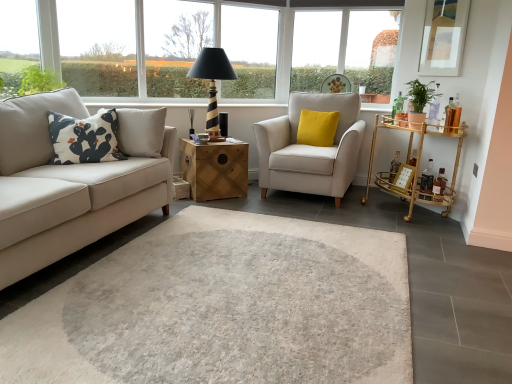
I want to click on transparent glass window at upper left, the first window frame from the left, so click(98, 47).

You are a GUI agent. You are given a task and a screenshot of the screen. Output one action in this format:
    pyautogui.click(x=<x>, y=<y>)
    Task: Click on the transparent glass window at upper left, which appears as the 2th window when viewed from the back
    This screenshot has width=512, height=384.
    Given the screenshot: What is the action you would take?
    pyautogui.click(x=17, y=42)

At what (x,y) coordinates should I click in order to perform the action: click on beige fabric armchair at center. Please return your answer as a coordinate pair (x, y). Looking at the image, I should click on (310, 148).

Based on the photo, in order to face beige fabric armchair at center, should I rotate leftwards or rightwards?

Turn right by 7.574 degrees to look at beige fabric armchair at center.

Locate an element on the screen. black striped wood table lamp at upper center is located at coordinates (212, 83).

Measure the distance between black striped wood table lamp at upper center and camera.

black striped wood table lamp at upper center and camera are 3.63 meters apart from each other.

This screenshot has width=512, height=384. What do you see at coordinates (84, 138) in the screenshot? I see `white printed cushion at left, arranged as the 2th pillow when viewed from the right` at bounding box center [84, 138].

This screenshot has width=512, height=384. What are the coordinates of `transparent glass window at upper left, which is the 2th window frame in back-to-front order` in the screenshot? It's located at (98, 47).

Considering the positions of points (84, 151) and (16, 59), is point (84, 151) closer to camera compared to point (16, 59)?

Yes, point (84, 151) is closer to viewer.

Does white printed cushion at left, arranged as the 2th pillow when viewed from the right, have a smaller size compared to transparent glass window at upper left, which appears as the 2th window when viewed from the back?

Incorrect, white printed cushion at left, arranged as the 2th pillow when viewed from the right, is not smaller in size than transparent glass window at upper left, which appears as the 2th window when viewed from the back.

From a real-world perspective, is white printed cushion at left, the 1th pillow in the left-to-right sequence, located higher than transparent glass window at upper left, arranged as the 1th window when viewed from the front?

Actually, white printed cushion at left, the 1th pillow in the left-to-right sequence, is physically below transparent glass window at upper left, arranged as the 1th window when viewed from the front, in the real world.

Between white printed cushion at left, arranged as the 2th pillow when viewed from the right, and transparent glass window at upper left, the second window in the right-to-left sequence, which one has less height?

white printed cushion at left, arranged as the 2th pillow when viewed from the right.

From a real-world perspective, which is physically above, transparent glass window at upper center, acting as the 1th window starting from the back, or yellow velvet cushion at center, the first pillow positioned from the back?

transparent glass window at upper center, acting as the 1th window starting from the back, is physically above.

Which is in front, point (170, 60) or point (330, 116)?

The point (330, 116) is more forward.

Is transparent glass window at upper center, the second window from the front, aimed at yellow velvet cushion at center, the first pillow positioned from the back?

No.

Does wooden chest at center, the 2th table from the right, have a lesser width compared to yellow velvet cushion at center, arranged as the first pillow when viewed from the right?

In fact, wooden chest at center, the 2th table from the right, might be wider than yellow velvet cushion at center, arranged as the first pillow when viewed from the right.

Considering the sizes of objects wooden chest at center, the first table from the left, and yellow velvet cushion at center, the first pillow positioned from the back, in the image provided, who is bigger, wooden chest at center, the first table from the left, or yellow velvet cushion at center, the first pillow positioned from the back,?

wooden chest at center, the first table from the left, is bigger.

Can you confirm if wooden chest at center, the first table from the left, is positioned to the right of yellow velvet cushion at center, which is the second pillow in left-to-right order?

In fact, wooden chest at center, the first table from the left, is to the left of yellow velvet cushion at center, which is the second pillow in left-to-right order.

Find the location of a particular element. pillow that is on the right side of wooden chest at center, the first table from the left is located at coordinates (317, 128).

How many degrees apart are the facing directions of matte white frame at upper right and transparent glass window at upper center, acting as the 1th window starting from the back?

matte white frame at upper right and transparent glass window at upper center, acting as the 1th window starting from the back, are facing 91.1 degrees away from each other.

Is matte white frame at upper right facing towards transparent glass window at upper center, the 1th window positioned from the right?

No, matte white frame at upper right is not aimed at transparent glass window at upper center, the 1th window positioned from the right.

In terms of height, does matte white frame at upper right look taller or shorter compared to transparent glass window at upper center, which is the second window from left to right?

matte white frame at upper right is shorter than transparent glass window at upper center, which is the second window from left to right.

Which object is positioned more to the right, matte white frame at upper right or transparent glass window at upper center, the second window from the front?

matte white frame at upper right.

Is beige fabric armchair at center to the right of transparent glass window at upper left, arranged as the 1th window when viewed from the front, from the viewer's perspective?

Yes.

Locate an element on the screen. The width and height of the screenshot is (512, 384). chair that is on the right side of transparent glass window at upper left, which appears as the first window when viewed from the left is located at coordinates (310, 148).

Is point (354, 122) farther from camera compared to point (1, 64)?

That is True.

Is matte white frame at upper right turned away from beige fabric armchair at center?

That's not correct — matte white frame at upper right is not looking away from beige fabric armchair at center.

From a real-world perspective, which object stands above the other?

In real-world perspective, matte white frame at upper right is above.

Between point (454, 53) and point (352, 131), which one is positioned in front?

Point (454, 53)

Between transparent glass window at upper left, the 2th window frame when ordered from right to left, and transparent glass window at upper left, which appears as the first window when viewed from the left, which one has smaller size?

transparent glass window at upper left, which appears as the first window when viewed from the left.

Is transparent glass window at upper left, the first window frame from the left, taller or shorter than transparent glass window at upper left, which appears as the 2th window when viewed from the back?

Considering their sizes, transparent glass window at upper left, the first window frame from the left, has more height than transparent glass window at upper left, which appears as the 2th window when viewed from the back.

Does point (125, 82) come closer to viewer compared to point (0, 36)?

No.

Locate an element on the screen. the 2nd pillow below the transparent glass window at upper left, the second window in the right-to-left sequence (from the image's perspective) is located at coordinates (84, 138).

From the yellow velvet cushion at center, arranged as the 2th pillow when viewed from the front, count 1st windows forward and point to it. Please provide its 2D coordinates.

[(175, 46)]

From the image, which object appears to be farther from white printed cushion at left, which is counted as the 2th pillow, starting from the back, gold bamboo bar cart at right, positioned as the second table in left-to-right order, or white plastic window frame at upper center, the 1th window frame when ordered from back to front?

white plastic window frame at upper center, the 1th window frame when ordered from back to front, lies further to white printed cushion at left, which is counted as the 2th pillow, starting from the back, than the other object.

Considering their positions, is white plastic window frame at upper center, placed as the second window frame when sorted from left to right, positioned further to transparent glass window at upper center, the 1th window positioned from the right, than transparent glass window at upper left, which appears as the 2th window when viewed from the back?

Based on the image, transparent glass window at upper left, which appears as the 2th window when viewed from the back, appears to be further to transparent glass window at upper center, the 1th window positioned from the right.

When comparing their distances from beige fabric armchair at center, does gold bamboo bar cart at right, the first table from the right, or matte white frame at upper right seem further?

Among the two, matte white frame at upper right is located further to beige fabric armchair at center.

Looking at the image, which one is located further to yellow velvet cushion at center, the first pillow positioned from the back, beige fabric armchair at center or wooden chest at center, the 2th table from the right?

wooden chest at center, the 2th table from the right, is positioned further to the anchor yellow velvet cushion at center, the first pillow positioned from the back.

Based on their spatial positions, is matte white frame at upper right or gold bamboo bar cart at right, positioned as the second table in left-to-right order, further from black striped wood table lamp at upper center?

matte white frame at upper right is further to black striped wood table lamp at upper center.

Considering their positions, is wooden chest at center, the first table from the left, positioned closer to white printed cushion at left, the 1th pillow in the left-to-right sequence, than transparent glass window at upper left, the second window in the right-to-left sequence?

wooden chest at center, the first table from the left, is positioned closer to the anchor white printed cushion at left, the 1th pillow in the left-to-right sequence.

From the picture: Looking at the image, which one is located further to wooden chest at center, the 2th table from the right, beige fabric armchair at center or white plastic window frame at upper center, which is the 1th window frame from right to left?

white plastic window frame at upper center, which is the 1th window frame from right to left.

When comparing their distances from white printed cushion at left, the 1th pillow positioned from the front, does beige fabric armchair at center or transparent glass window at upper left, which is the 2th window frame in back-to-front order, seem closer?

Based on the image, beige fabric armchair at center appears to be nearer to white printed cushion at left, the 1th pillow positioned from the front.

Where is `window frame located between white printed cushion at left, which is counted as the 2th pillow, starting from the back, and gold bamboo bar cart at right, positioned as the second table in left-to-right order, in the left-right direction`? The width and height of the screenshot is (512, 384). window frame located between white printed cushion at left, which is counted as the 2th pillow, starting from the back, and gold bamboo bar cart at right, positioned as the second table in left-to-right order, in the left-right direction is located at coordinates (250, 51).

Locate an element on the screen. The height and width of the screenshot is (384, 512). table lamp between white printed cushion at left, the 1th pillow positioned from the front, and wooden chest at center, the 2th table from the right, from front to back is located at coordinates (212, 83).

Locate an element on the screen. This screenshot has width=512, height=384. window frame between transparent glass window at upper center, acting as the 1th window starting from the back, and matte white frame at upper right is located at coordinates coord(250,51).

Where is `window situated between transparent glass window at upper left, which appears as the 2th window when viewed from the back, and yellow velvet cushion at center, which is the second pillow in left-to-right order, from left to right`? This screenshot has width=512, height=384. window situated between transparent glass window at upper left, which appears as the 2th window when viewed from the back, and yellow velvet cushion at center, which is the second pillow in left-to-right order, from left to right is located at coordinates (175, 46).